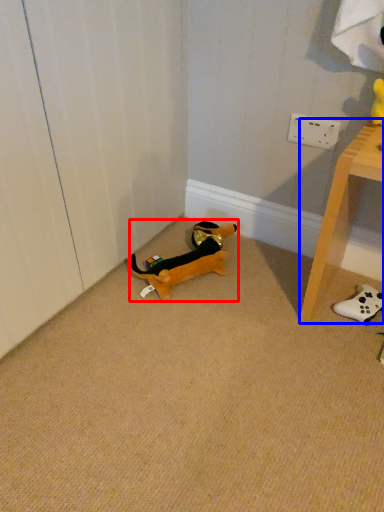
Question: Among these objects, which one is farthest to the camera, toy (highlighted by a red box) or furniture (highlighted by a blue box)?

Choices:
 (A) toy
 (B) furniture

Answer: (A)